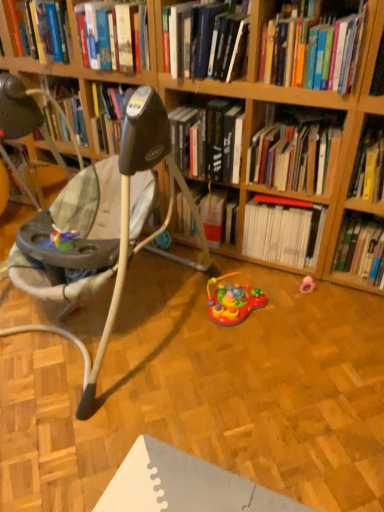
I want to click on free spot below multicolored plastic toy at center, marked as the second toy in a right-to-left arrangement (from a real-world perspective), so click(243, 317).